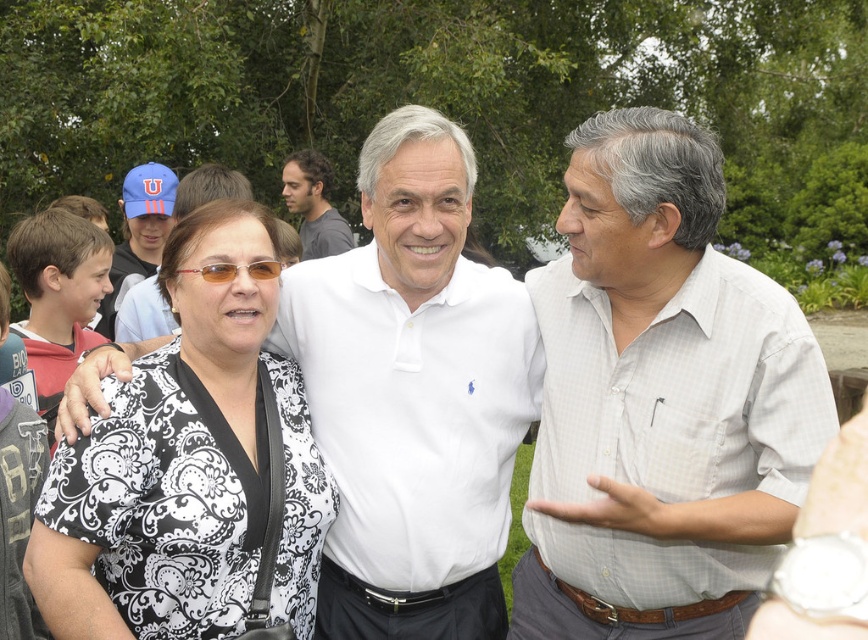
Which is above, white checkered shirt at center or dark gray shirt at upper center?

Positioned higher is dark gray shirt at upper center.

Does point (596, 209) come farther from viewer compared to point (321, 248)?

No, it is in front of (321, 248).

Find the location of a particular element. white checkered shirt at center is located at coordinates (661, 401).

Is point (498, 417) closer to camera compared to point (125, 237)?

Yes.

Is white cotton shirt at center wider than blue fabric cap at upper left?

Indeed, white cotton shirt at center has a greater width compared to blue fabric cap at upper left.

Which is in front, point (419, 252) or point (129, 262)?

Positioned in front is point (419, 252).

Identify the location of white cotton shirt at center. The width and height of the screenshot is (868, 640). (413, 394).

Does point (691, 364) come closer to viewer compared to point (182, 333)?

Yes, point (691, 364) is in front of point (182, 333).

Who is positioned more to the left, white checkered shirt at center or black printed blouse at center?

black printed blouse at center is more to the left.

What are the coordinates of `white checkered shirt at center` in the screenshot? It's located at (661, 401).

Identify the location of white checkered shirt at center. The width and height of the screenshot is (868, 640). (661, 401).